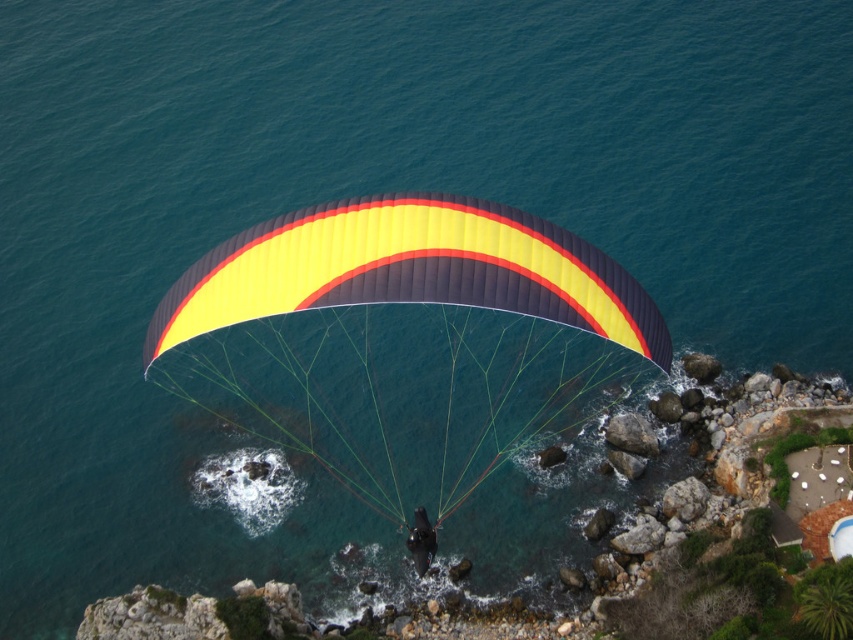
Question: Can you confirm if yellow matte parachute at center is wider than matte black helmet at center?

Choices:
 (A) yes
 (B) no

Answer: (A)

Question: Which of the following is the farthest from the observer?

Choices:
 (A) yellow matte parachute at center
 (B) matte black helmet at center

Answer: (B)

Question: Which of the following is the farthest from the observer?

Choices:
 (A) (415, 508)
 (B) (277, 257)

Answer: (A)

Question: Is yellow matte parachute at center further to the viewer compared to matte black helmet at center?

Choices:
 (A) no
 (B) yes

Answer: (A)

Question: Is yellow matte parachute at center further to camera compared to matte black helmet at center?

Choices:
 (A) yes
 (B) no

Answer: (B)

Question: Which object appears farthest from the camera in this image?

Choices:
 (A) matte black helmet at center
 (B) yellow matte parachute at center

Answer: (A)